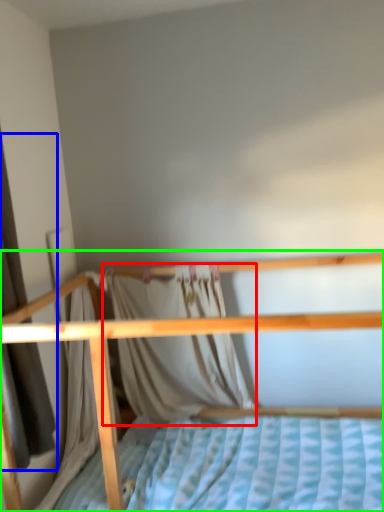
Question: Estimate the real-world distances between objects in this image. Which object is closer to curtain (highlighted by a red box), curtain (highlighted by a blue box) or bed (highlighted by a green box)?

Choices:
 (A) curtain
 (B) bed

Answer: (B)